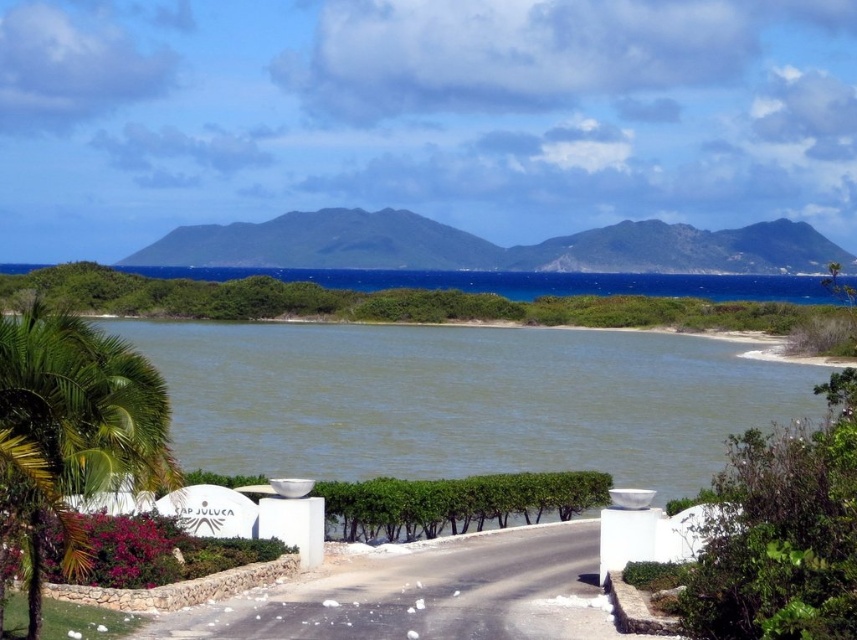
You are standing at the entrance marked by the white structure with the text JULUCA on the left side of the image. You want to walk towards the green water at center. Which direction should you turn to avoid the green leafy palm tree at lower left?

You should turn to the right to avoid the green leafy palm tree at lower left, as the green water at center is positioned on the right side of the green leafy palm tree at lower left.

You are standing at the entrance marked by the white structure with the text JULUCA. You see two points in the scene, point (382, 371) and point (103, 483). Which point is closer to you?

Point (382, 371) is further to the viewer than point (103, 483), so the point closer to you is point (103, 483).

You are a landscape designer assessing the coastal scene. You need to determine which object occupies more visual space in the image. Based on the scene, which one is larger between the green water at center and the green leafy palm tree at lower left?

The green water at center is bigger than the green leafy palm tree at lower left, so the green water at center occupies more visual space in the image.